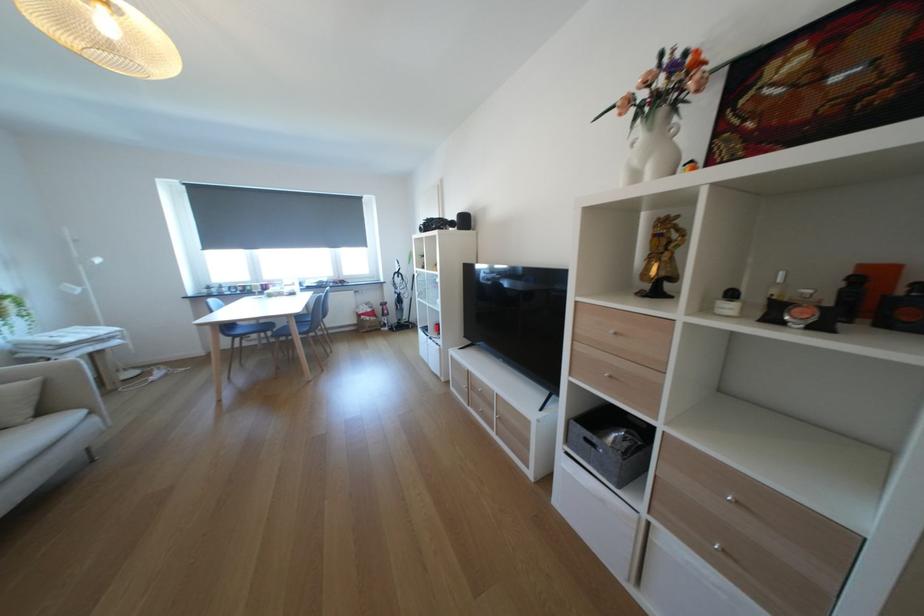
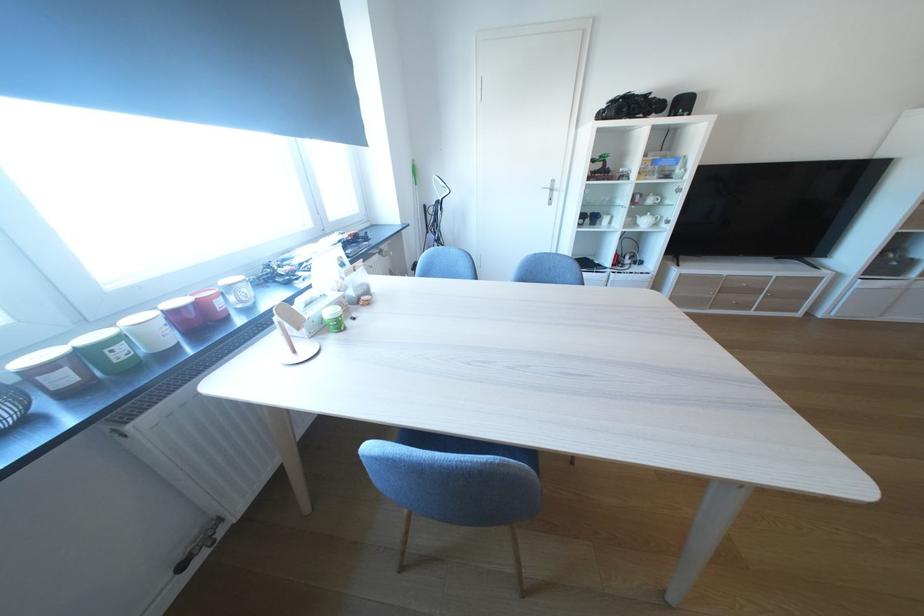
The point at (251, 290) is marked in the first image. Where is the corresponding point in the second image?

(75, 379)